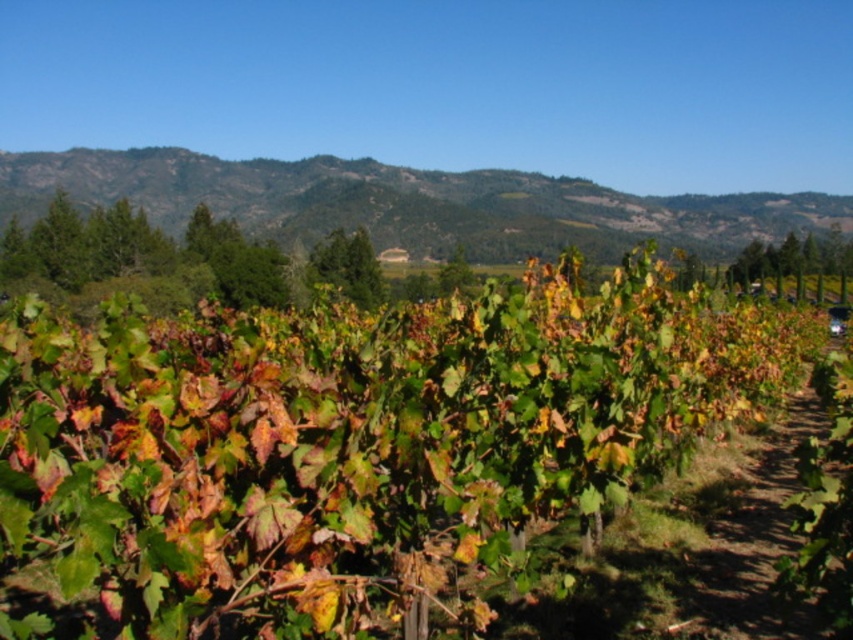
Question: In this image, where is green leafy vegetation at upper center located relative to dirt path at center?

Choices:
 (A) above
 (B) below

Answer: (A)

Question: Which object is closer to the camera taking this photo?

Choices:
 (A) dirt path at center
 (B) green leafy vegetation at upper center

Answer: (A)

Question: Which object appears closest to the camera in this image?

Choices:
 (A) green leafy vegetation at upper center
 (B) dirt path at center

Answer: (B)

Question: Which object appears closest to the camera in this image?

Choices:
 (A) green leafy vegetation at upper center
 (B) dirt path at center

Answer: (B)

Question: Is green leafy vegetation at upper center positioned before dirt path at center?

Choices:
 (A) yes
 (B) no

Answer: (B)

Question: Can you confirm if green leafy vegetation at upper center is wider than dirt path at center?

Choices:
 (A) yes
 (B) no

Answer: (A)